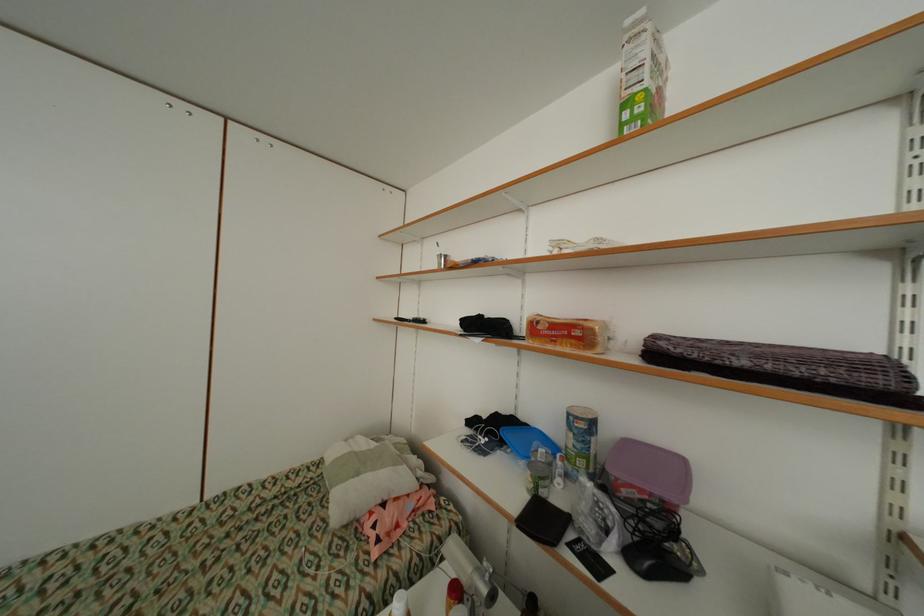
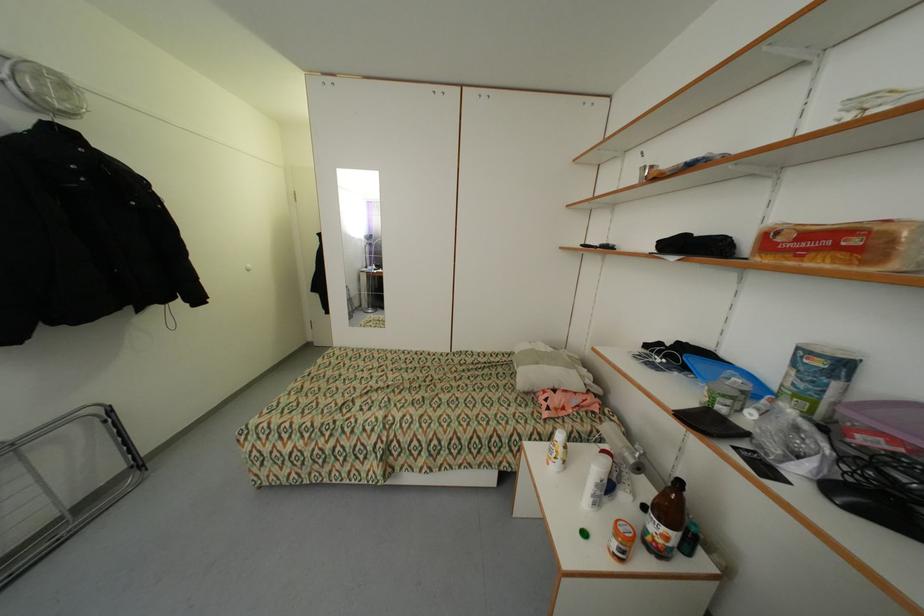
Question: The camera is either moving clockwise (left) or counter-clockwise (right) around the object. The first image is from the beginning of the video and the second image is from the end. Is the camera moving left or right when shooting the video?

Choices:
 (A) Left
 (B) Right

Answer: (B)